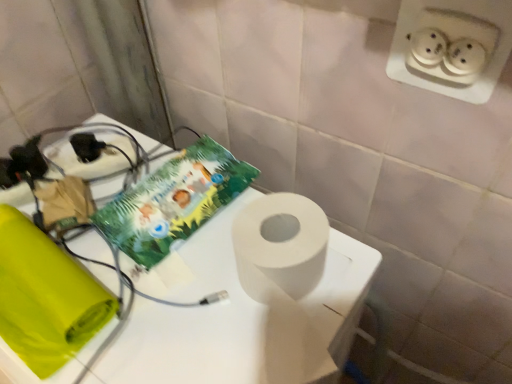
At what (x,y) coordinates should I click in order to perform the action: click on blank space situated above white matte table at center (from a real-world perspective). Please return your answer as a coordinate pair (x, y). The width and height of the screenshot is (512, 384). Looking at the image, I should click on (139, 264).